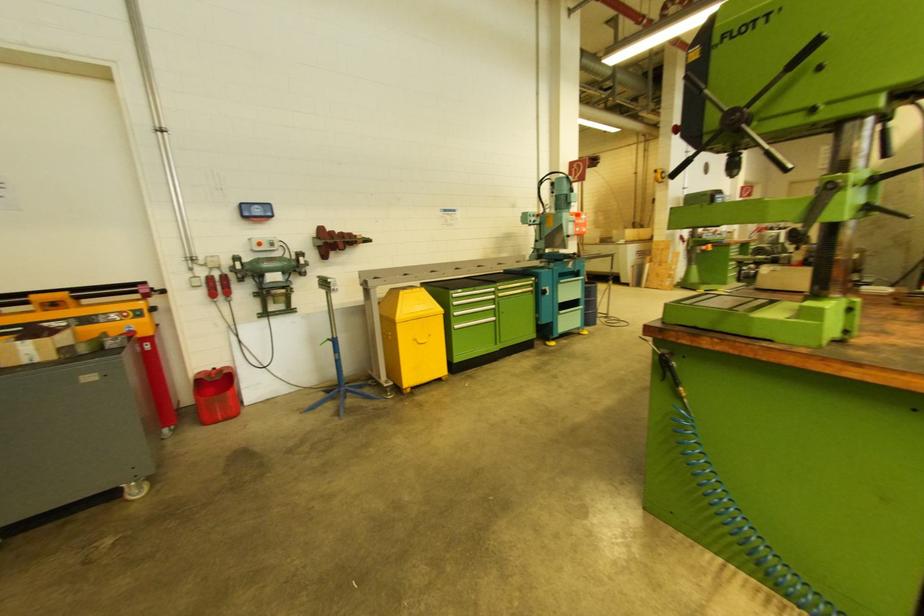
Locate an element on the screen. The image size is (924, 616). drill press handle is located at coordinates (334, 240).